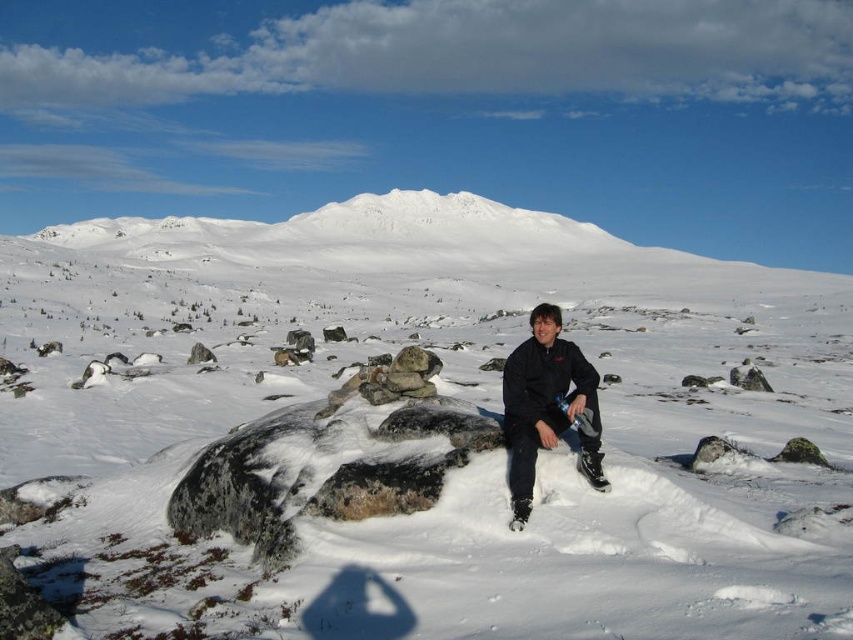
Question: Among these points, which one is nearest to the camera?

Choices:
 (A) (563, 349)
 (B) (613, 257)
 (C) (392, 528)

Answer: (C)

Question: Which point appears farthest from the camera in this image?

Choices:
 (A) (532, 337)
 (B) (233, 493)

Answer: (A)

Question: Which is nearer to the dark blue jacket at center?

Choices:
 (A) white fluffy snow at center
 (B) white snow-covered mountain at upper center

Answer: (A)

Question: Is white fluffy snow at center positioned behind white snow-covered mountain at upper center?

Choices:
 (A) yes
 (B) no

Answer: (B)

Question: Does white snow-covered mountain at upper center appear under dark blue jacket at center?

Choices:
 (A) yes
 (B) no

Answer: (B)

Question: Can you confirm if white snow-covered mountain at upper center is smaller than dark blue jacket at center?

Choices:
 (A) yes
 (B) no

Answer: (B)